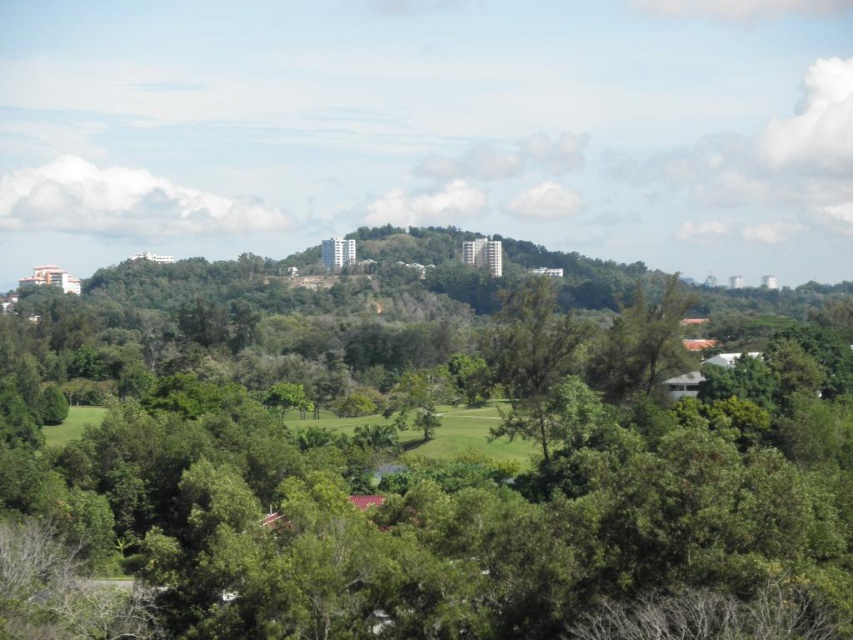
What do you see at coordinates (425, 460) in the screenshot? I see `green leafy tree at center` at bounding box center [425, 460].

Is green leafy tree at center positioned in front of green grassy field at center?

That is True.

At what (x,y) coordinates should I click in order to perform the action: click on green leafy tree at center. Please return your answer as a coordinate pair (x, y). Image resolution: width=853 pixels, height=640 pixels. Looking at the image, I should click on pyautogui.click(x=425, y=460).